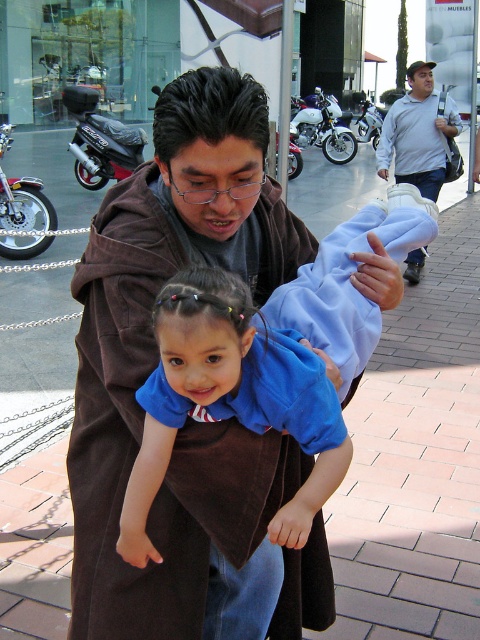
Question: Considering the relative positions of metallic silver motorcycle at left and white matte motorcycle at center in the image provided, where is metallic silver motorcycle at left located with respect to white matte motorcycle at center?

Choices:
 (A) right
 (B) left

Answer: (B)

Question: Can you confirm if blue cotton shirt at center is positioned to the left of silver metallic motorcycle at center?

Choices:
 (A) no
 (B) yes

Answer: (B)

Question: Is black matte scooter at upper left below silver metallic motorcycle at center?

Choices:
 (A) yes
 (B) no

Answer: (A)

Question: Which of the following is the farthest from the observer?

Choices:
 (A) blue cotton shirt at center
 (B) light blue jeans at right
 (C) metallic silver motorcycle at left
 (D) brown soft robe at center

Answer: (B)

Question: Which of these objects is positioned closest to the black matte scooter at upper left?

Choices:
 (A) metallic silver motorcycle at left
 (B) white matte motorcycle at center
 (C) silver metallic motorcycle at center

Answer: (A)

Question: Estimate the real-world distances between objects in this image. Which object is farther from the brown soft robe at center?

Choices:
 (A) white matte motorcycle at center
 (B) black matte scooter at upper left

Answer: (A)